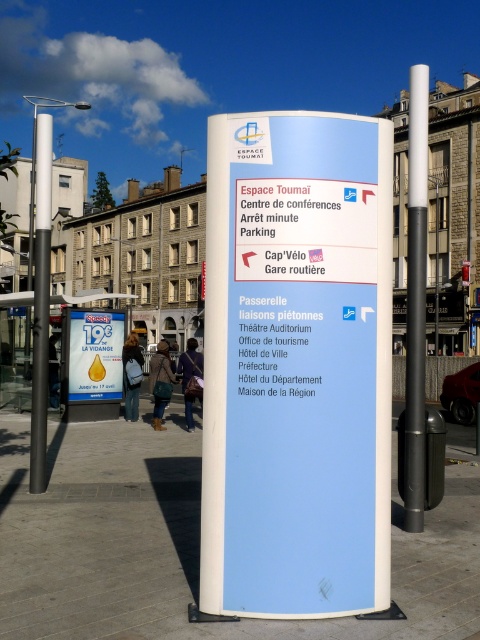
You are a tourist navigating the town using the large light blue signpost. You notice two points marked on the signpost at coordinates point (361, 474) and point (188, 424). Which point is closer to you as you face the signpost?

Point (361, 474) is in front of point (188, 424), so it is closer to you as you face the signpost.

You are a tourist holding a dark brown leather bag at center and looking at a white plastic sign at center. Which object is positioned to the right of the other?

The white plastic sign at center is to the right of the dark brown leather bag at center.